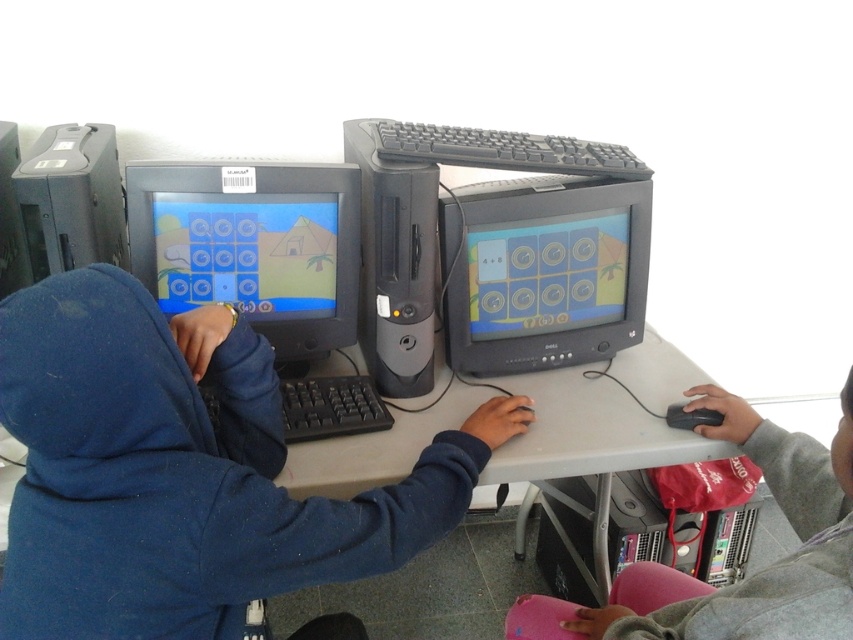
Based on the photo, who is taller, blue fleece hoodie at left or matte black monitor at center?

Standing taller between the two is blue fleece hoodie at left.

Between blue fleece hoodie at left and matte black monitor at center, which one is positioned higher?

matte black monitor at center

The image size is (853, 640). I want to click on blue fleece hoodie at left, so click(x=183, y=474).

Where is `blue fleece hoodie at left`? The height and width of the screenshot is (640, 853). blue fleece hoodie at left is located at coordinates (183, 474).

Between matte black monitor at left and gray matte mouse at lower right, which one has less height?

matte black monitor at left is shorter.

The width and height of the screenshot is (853, 640). In order to click on matte black monitor at left in this screenshot , I will do pyautogui.click(x=252, y=244).

Is gray matte mouse at lower right to the right of black plastic keyboard at center from the viewer's perspective?

Correct, you'll find gray matte mouse at lower right to the right of black plastic keyboard at center.

Is gray matte mouse at lower right shorter than black plastic keyboard at center?

In fact, gray matte mouse at lower right may be taller than black plastic keyboard at center.

Image resolution: width=853 pixels, height=640 pixels. What do you see at coordinates (778, 561) in the screenshot?
I see `gray matte mouse at lower right` at bounding box center [778, 561].

Identify the location of gray matte mouse at lower right. (778, 561).